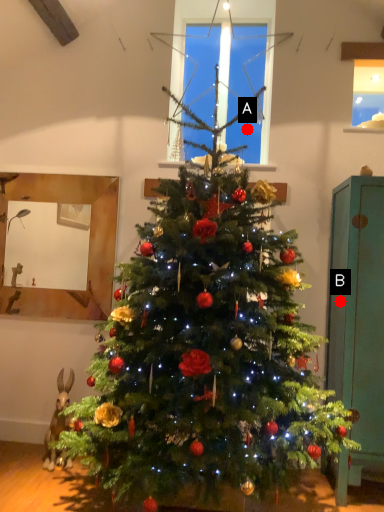
Question: Two points are circled on the image, labeled by A and B beside each circle. Which point is closer to the camera?

Choices:
 (A) A is closer
 (B) B is closer

Answer: (B)